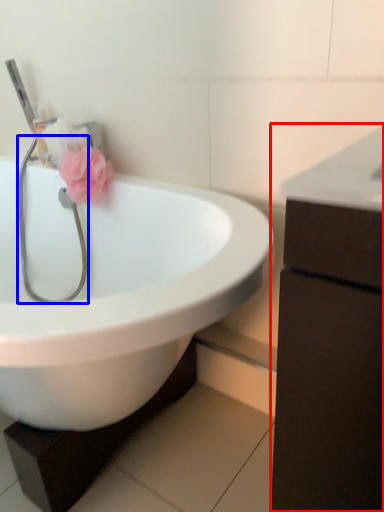
Question: Which object appears farthest to the camera in this image, bathroom cabinet (highlighted by a red box) or stethoscope (highlighted by a blue box)?

Choices:
 (A) bathroom cabinet
 (B) stethoscope

Answer: (B)